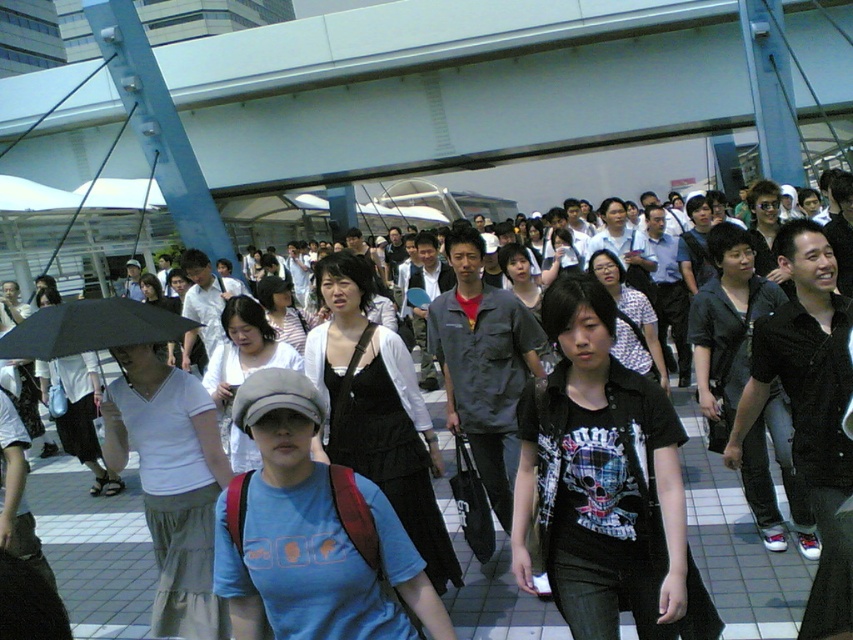
Who is more distant from viewer, (x=45, y=499) or (x=102, y=301)?

The point (x=45, y=499) is more distant.

Between point (757, 616) and point (144, 308), which one is positioned in front?

Point (757, 616) is in front.

What are the coordinates of `matte black dress at center` in the screenshot? It's located at (94, 548).